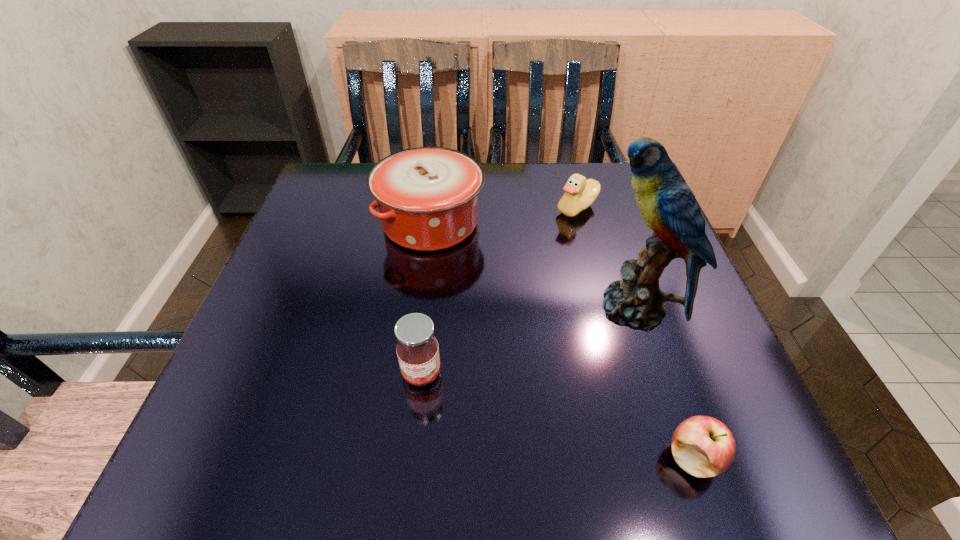
You are a GUI agent. You are given a task and a screenshot of the screen. Output one action in this format:
    pyautogui.click(x=<x>, y=<y>)
    Task: Click on the tallest object
    Image resolution: width=960 pixels, height=540 pixels.
    Given the screenshot: What is the action you would take?
    pyautogui.click(x=668, y=207)

At what (x,y) coordinates should I click in order to perform the action: click on the third nearest object. Please return your answer as a coordinate pair (x, y). The width and height of the screenshot is (960, 540). Looking at the image, I should click on (668, 207).

This screenshot has height=540, width=960. I want to click on the fourth shortest object, so click(427, 197).

Identify the location of the third shortest object. The width and height of the screenshot is (960, 540). (417, 349).

Find the location of a particular element. The image size is (960, 540). the second nearest object is located at coordinates (417, 349).

What are the coordinates of `the fourth tallest object` in the screenshot? It's located at (580, 193).

At what (x,y) coordinates should I click in order to perform the action: click on the nearest object. Please return your answer as a coordinate pair (x, y). Looking at the image, I should click on (704, 447).

Identify the location of the shortest object. (704, 447).

At what (x,y) coordinates should I click in order to perform the action: click on vacant point located 0.090m on the face of the third farthest object. Please return your answer as a coordinate pair (x, y). Looking at the image, I should click on (541, 309).

Image resolution: width=960 pixels, height=540 pixels. Identify the location of blank space located on the face of the third farthest object. (399, 309).